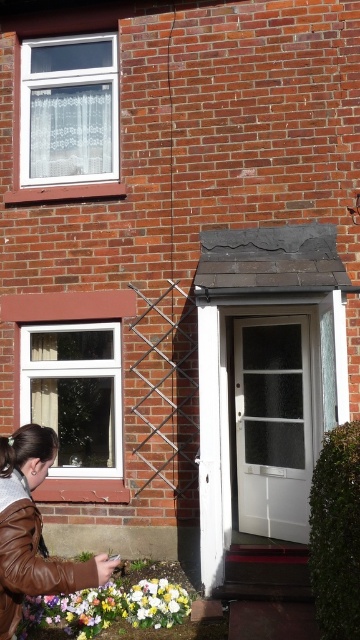
You are standing in front of the brick house and notice the brown leather jacket at lower left and the glossy floral bouquet at lower center. Which object takes up more space?

The glossy floral bouquet at lower center takes up more space than the brown leather jacket at lower left.

You are standing in front of the brick house and see the brown leather jacket at lower left and the glossy floral bouquet at lower center. Which object is positioned higher up?

The brown leather jacket at lower left is above the glossy floral bouquet at lower center, so it is positioned higher up.